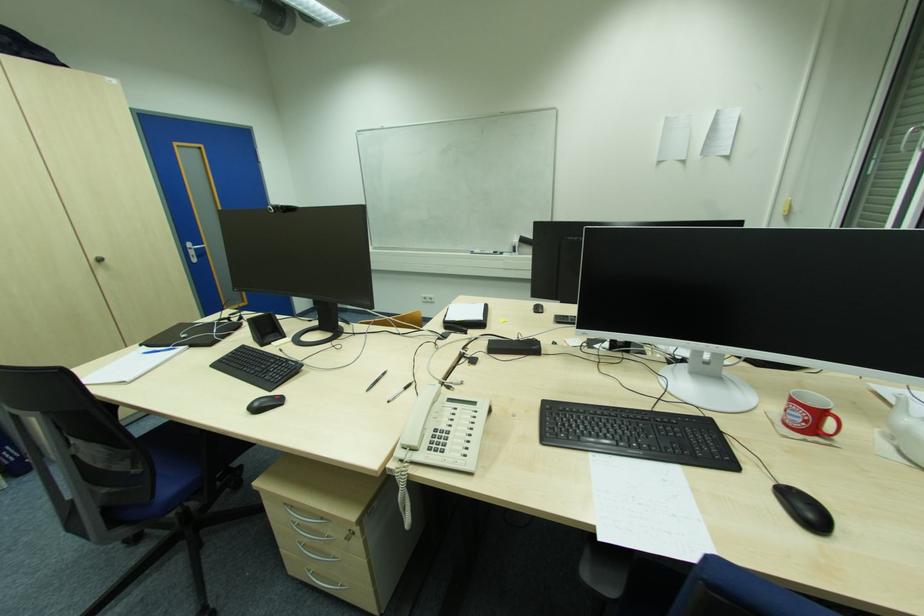
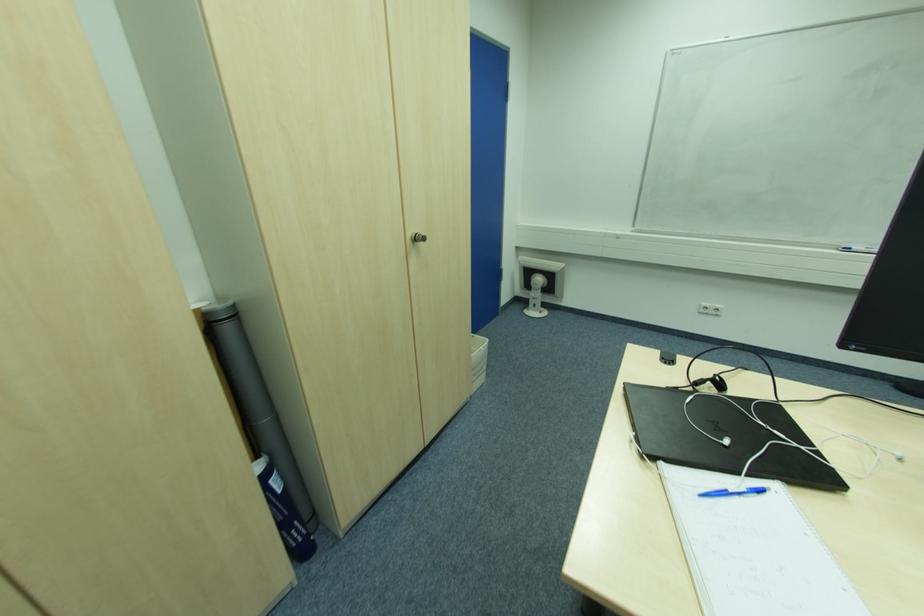
The point at (103, 261) is marked in the first image. Where is the corresponding point in the second image?

(419, 240)